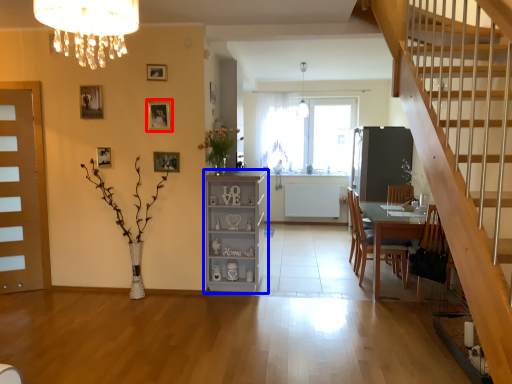
Question: Which point is further to the camera, picture frame (highlighted by a red box) or cabinetry (highlighted by a blue box)?

Choices:
 (A) picture frame
 (B) cabinetry

Answer: (B)